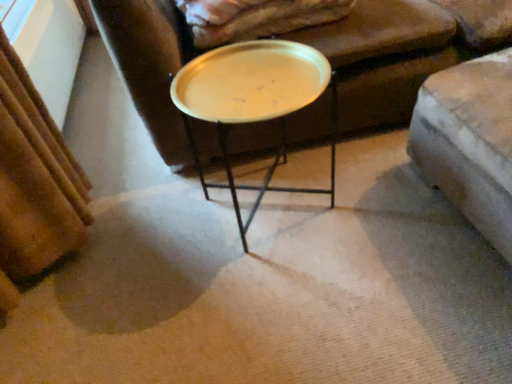
Identify the location of vacant space to the right of metallic gold tray at center. The image size is (512, 384). (382, 195).